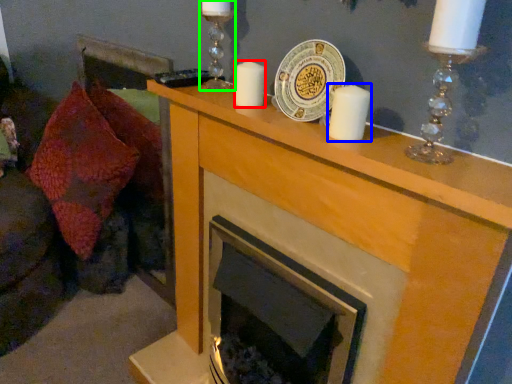
Question: Considering the real-world distances, which object is closest to candle (highlighted by a red box)? candle (highlighted by a blue box) or candle holder (highlighted by a green box).

Choices:
 (A) candle
 (B) candle holder

Answer: (B)